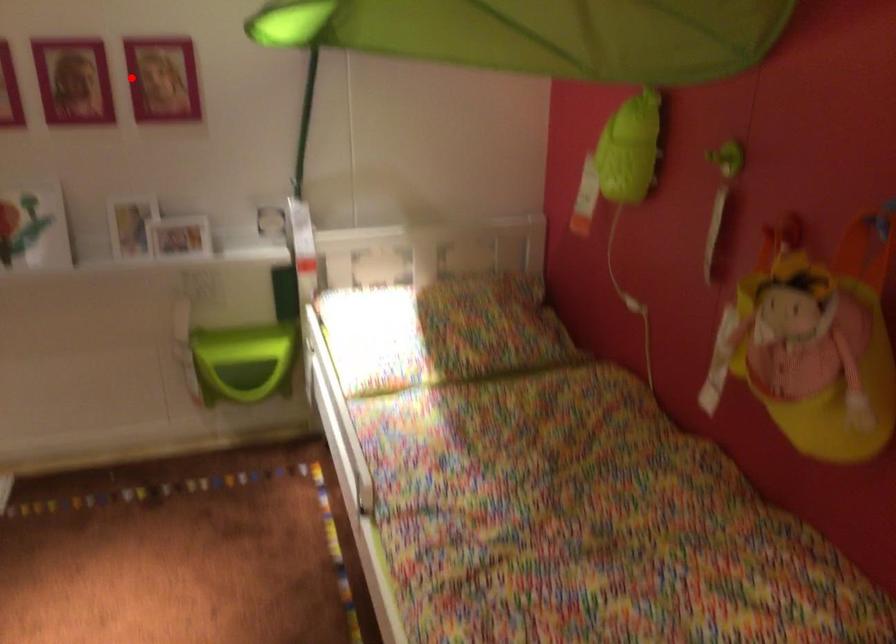
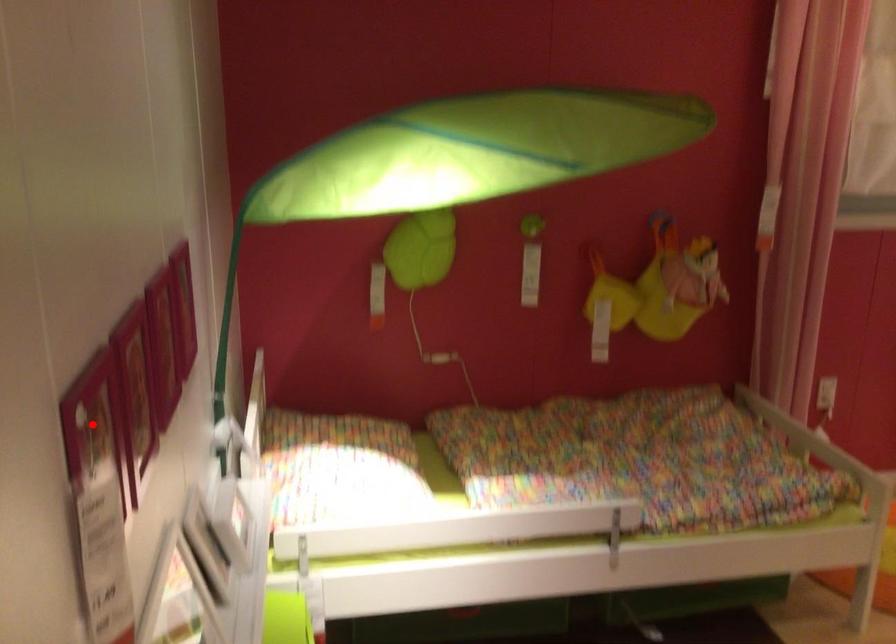
From the picture: I am providing you with two images of the same scene from different viewpoints. A red point is marked on the first image and another point is marked on the second image. Is the marked point in image1 the same physical position as the marked point in image2?

No